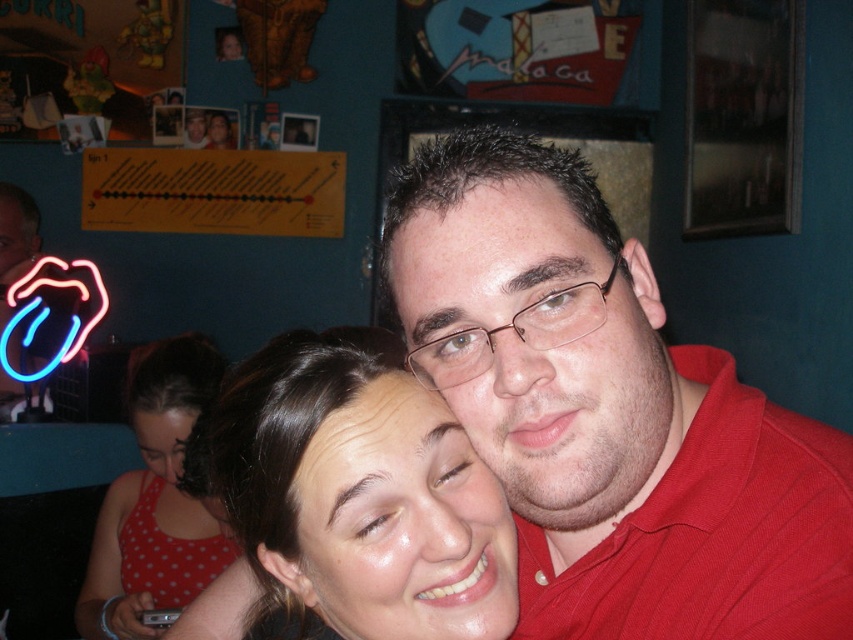
Who is higher up, matte red shirt at center or neon blue tongue at left?

Positioned higher is neon blue tongue at left.

Does matte red shirt at center have a smaller size compared to neon blue tongue at left?

Indeed, matte red shirt at center has a smaller size compared to neon blue tongue at left.

Which is behind, point (483, 426) or point (3, 365)?

Point (3, 365)

I want to click on matte red shirt at center, so click(x=608, y=412).

Is polka dot fabric dress at lower left bigger than neon blue tongue at left?

Actually, polka dot fabric dress at lower left might be smaller than neon blue tongue at left.

What do you see at coordinates (155, 500) in the screenshot? Image resolution: width=853 pixels, height=640 pixels. I see `polka dot fabric dress at lower left` at bounding box center [155, 500].

Is point (152, 356) positioned before point (77, 333)?

That is True.

Locate an element on the screen. The image size is (853, 640). polka dot fabric dress at lower left is located at coordinates (155, 500).

Can you confirm if smooth skin face at center is shorter than neon blue tongue at left?

Yes, smooth skin face at center is shorter than neon blue tongue at left.

Is smooth skin face at center smaller than neon blue tongue at left?

Correct, smooth skin face at center occupies less space than neon blue tongue at left.

Where is `smooth skin face at center`? Image resolution: width=853 pixels, height=640 pixels. smooth skin face at center is located at coordinates (361, 493).